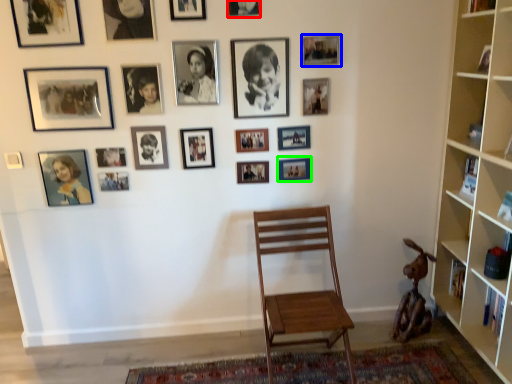
Question: Based on their relative distances, which object is farther from picture frame (highlighted by a red box)? Choose from picture frame (highlighted by a blue box) and picture frame (highlighted by a green box).

Choices:
 (A) picture frame
 (B) picture frame

Answer: (B)